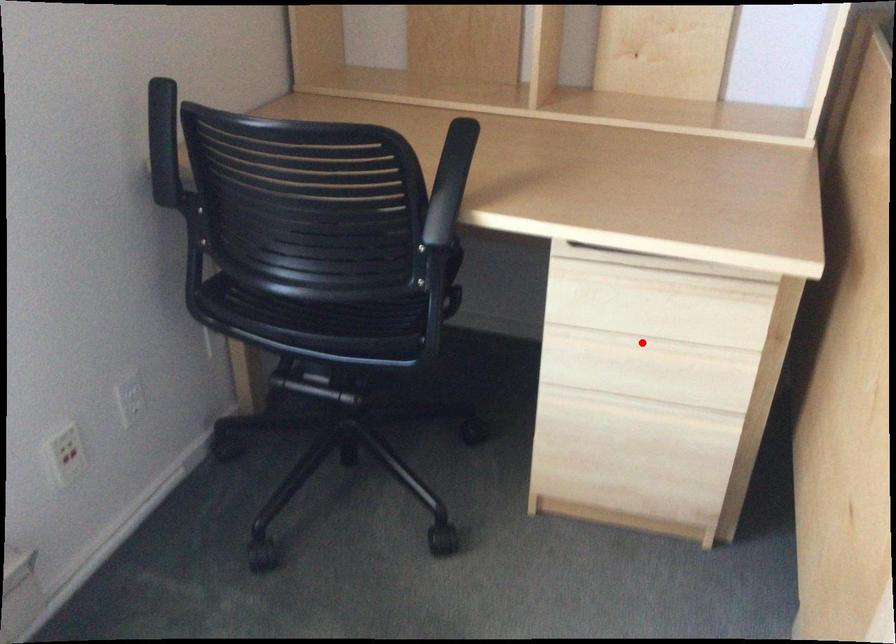
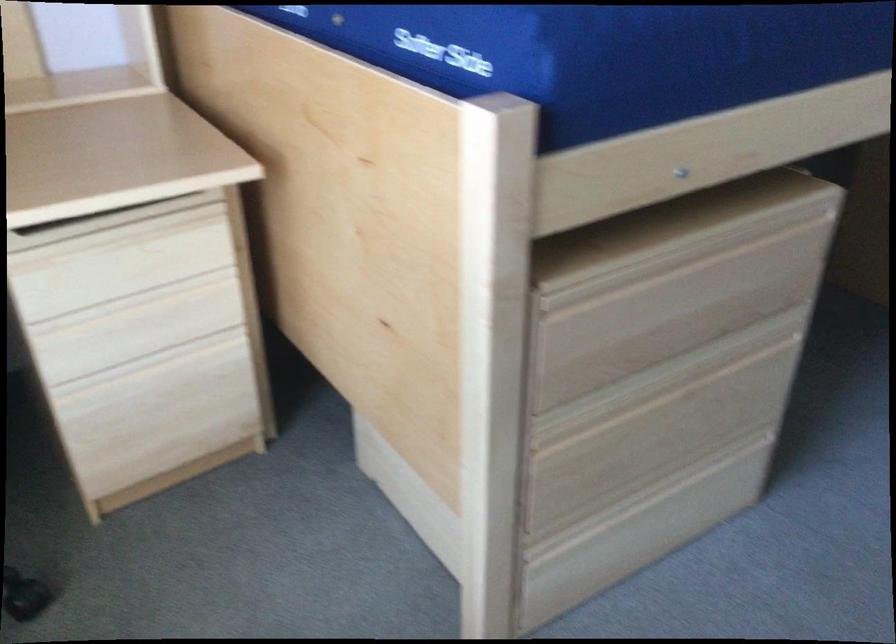
In the second image, find the point that corresponds to the highlighted location in the first image.

(134, 301)